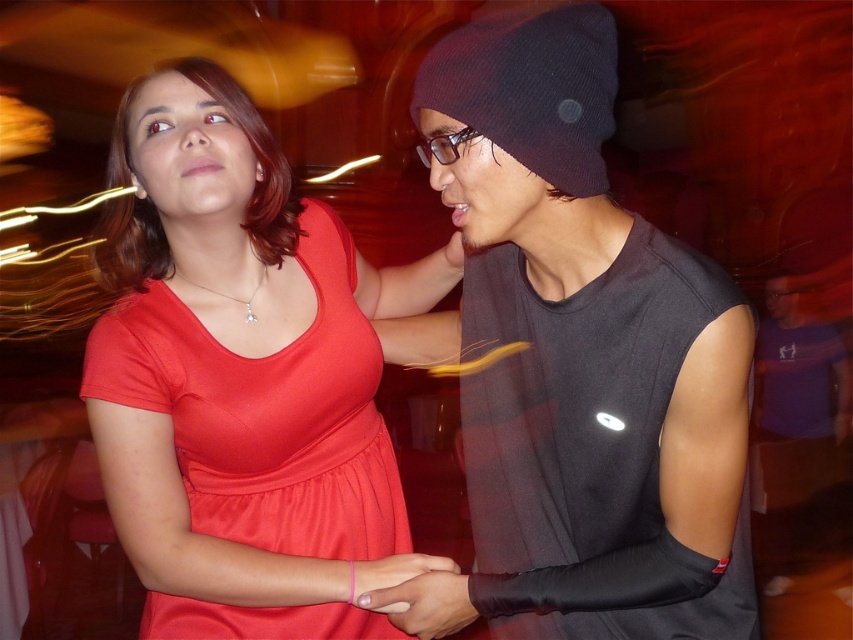
Is black matte shirt at right behind pink rubber band at center?

That is True.

Is black matte shirt at right above pink rubber band at center?

Actually, black matte shirt at right is below pink rubber band at center.

Find the location of `black matte shirt at right`. black matte shirt at right is located at coordinates (795, 419).

Image resolution: width=853 pixels, height=640 pixels. Identify the location of black matte shirt at right. (795, 419).

Can you confirm if black knit beanie at upper right is thinner than pink matte wristband at center?

In fact, black knit beanie at upper right might be wider than pink matte wristband at center.

Image resolution: width=853 pixels, height=640 pixels. Identify the location of black knit beanie at upper right. (579, 353).

Which is below, pink matte wristband at center or pink rubber band at center?

pink matte wristband at center is lower down.

Can you confirm if pink matte wristband at center is positioned to the right of pink rubber band at center?

Indeed, pink matte wristband at center is positioned on the right side of pink rubber band at center.

Does point (422, 592) come in front of point (433, 561)?

Yes, it is.

I want to click on pink matte wristband at center, so click(425, 604).